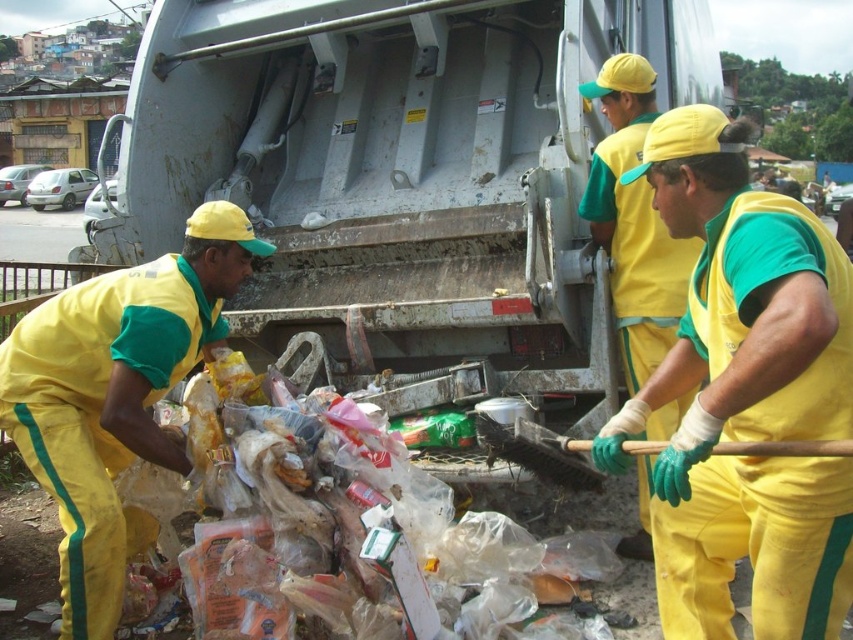
Question: Among these points, which one is nearest to the camera?

Choices:
 (A) (213, 115)
 (B) (631, 291)

Answer: (B)

Question: In this image, where is yellow/green fabric uniform at center located relative to yellow/green fabric uniform at lower left?

Choices:
 (A) above
 (B) below

Answer: (A)

Question: Which object is positioned closest to the metallic gray garbage truck at center?

Choices:
 (A) yellow fabric gloves at center
 (B) yellow/green fabric uniform at center
 (C) yellow/green fabric uniform at lower left

Answer: (A)

Question: Is yellow/green fabric uniform at center above yellow fabric gloves at center?

Choices:
 (A) yes
 (B) no

Answer: (B)

Question: Which object is closer to the camera taking this photo?

Choices:
 (A) metallic gray garbage truck at center
 (B) yellow/green fabric uniform at lower left
 (C) yellow/green fabric uniform at center

Answer: (C)

Question: Does yellow/green fabric uniform at center lie in front of yellow fabric gloves at center?

Choices:
 (A) no
 (B) yes

Answer: (B)